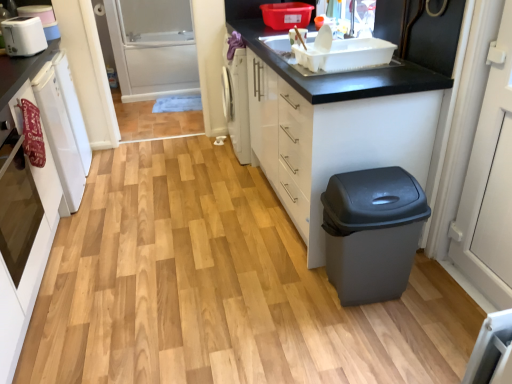
Where is `vacant space in front of white glossy cabinet at lower right, the 2th cabinetry when ordered from left to right`? The width and height of the screenshot is (512, 384). vacant space in front of white glossy cabinet at lower right, the 2th cabinetry when ordered from left to right is located at coordinates (295, 309).